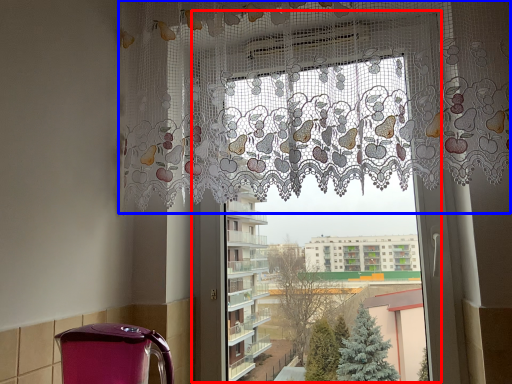
Question: Which of the following is the farthest to the observer, window frame (highlighted by a red box) or curtain (highlighted by a blue box)?

Choices:
 (A) window frame
 (B) curtain

Answer: (A)